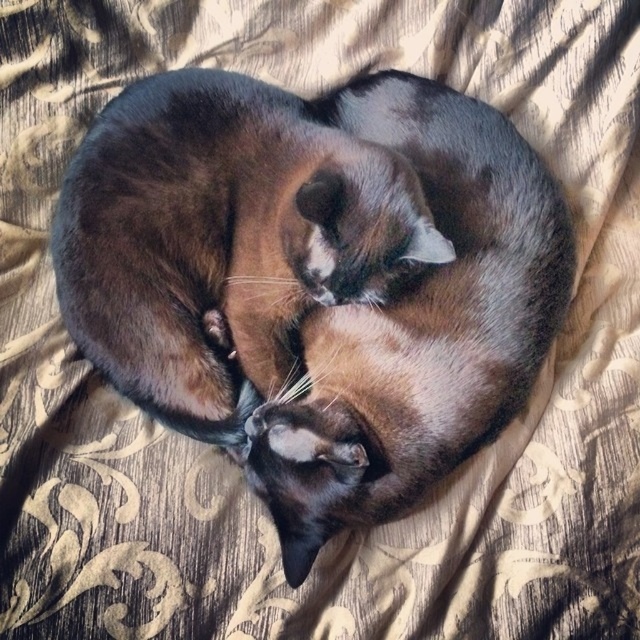
Which is in front, point (348, 195) or point (420, 420)?

Point (348, 195) is more forward.

Is shiny black cat at center above shiny brown cat at center?

Yes.

Who is more forward, (100, 360) or (449, 346)?

Point (449, 346)

Where is `shiny black cat at center`? This screenshot has width=640, height=640. shiny black cat at center is located at coordinates (221, 240).